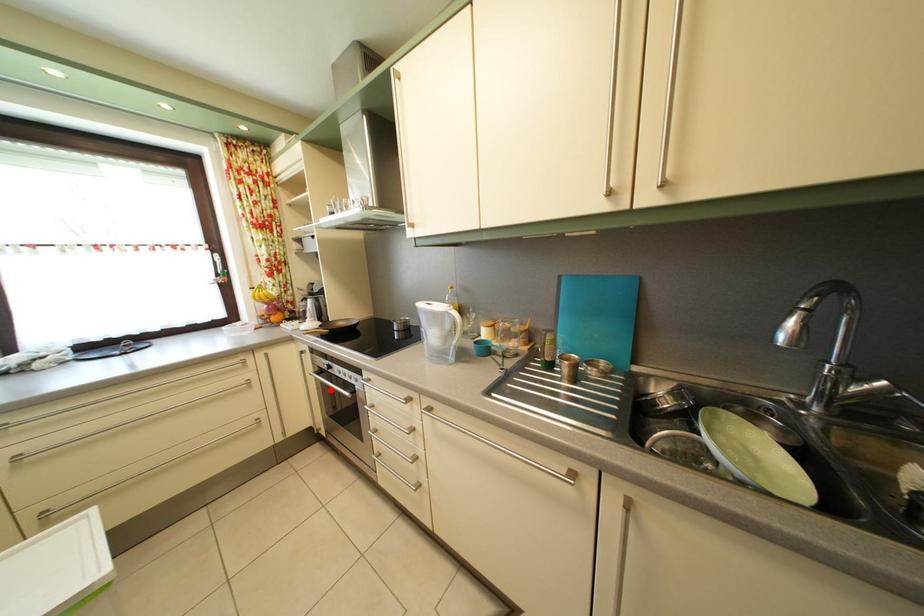
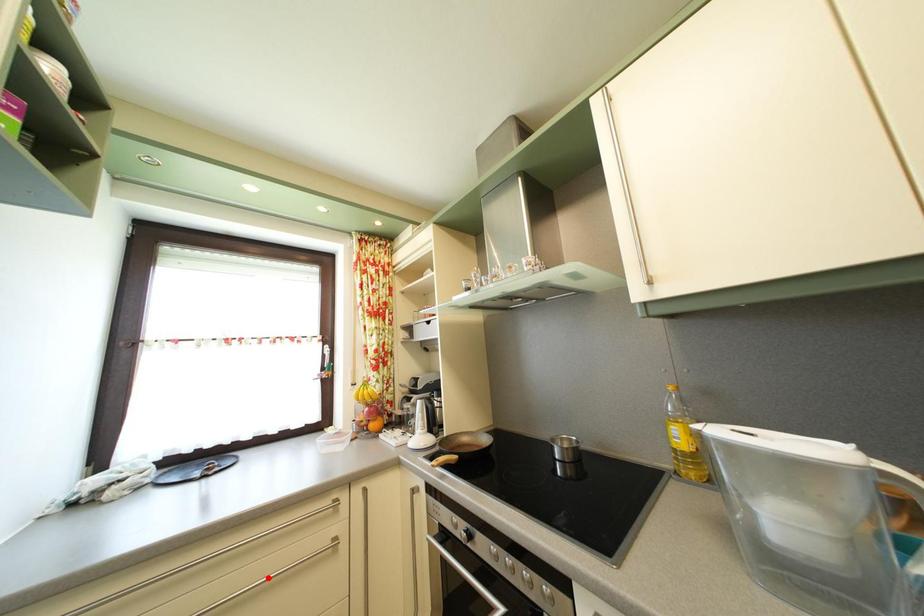
I am providing you with two images of the same scene from different viewpoints. A red point is marked on the first image and another point is marked on the second image. Is the marked point in image1 the same physical position as the marked point in image2?

No